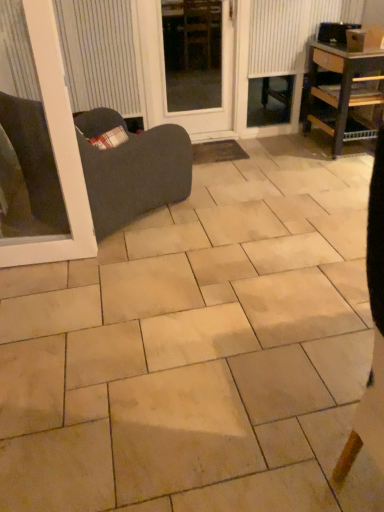
Identify the location of empty space that is ontop of beige ceramic tile at center. The image size is (384, 512). (233, 280).